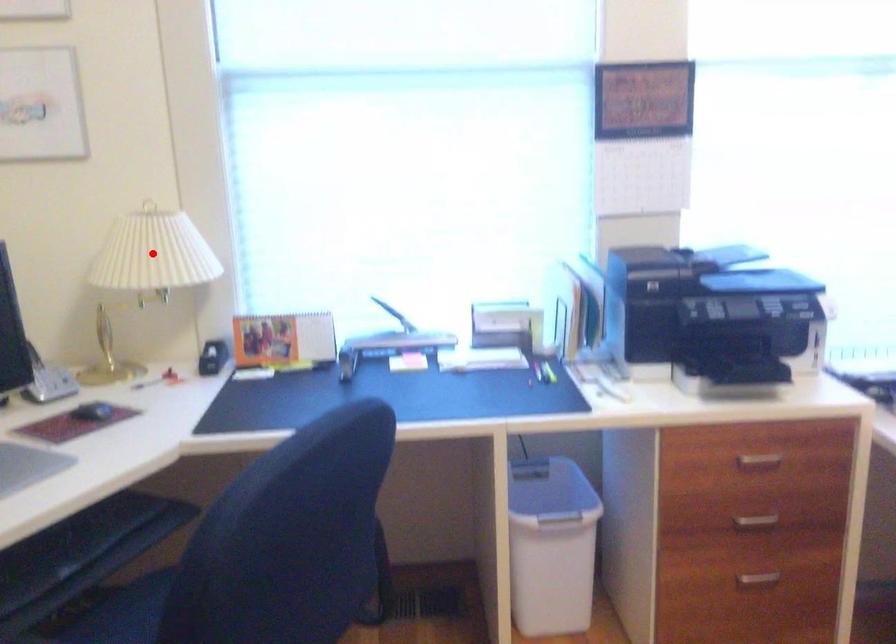
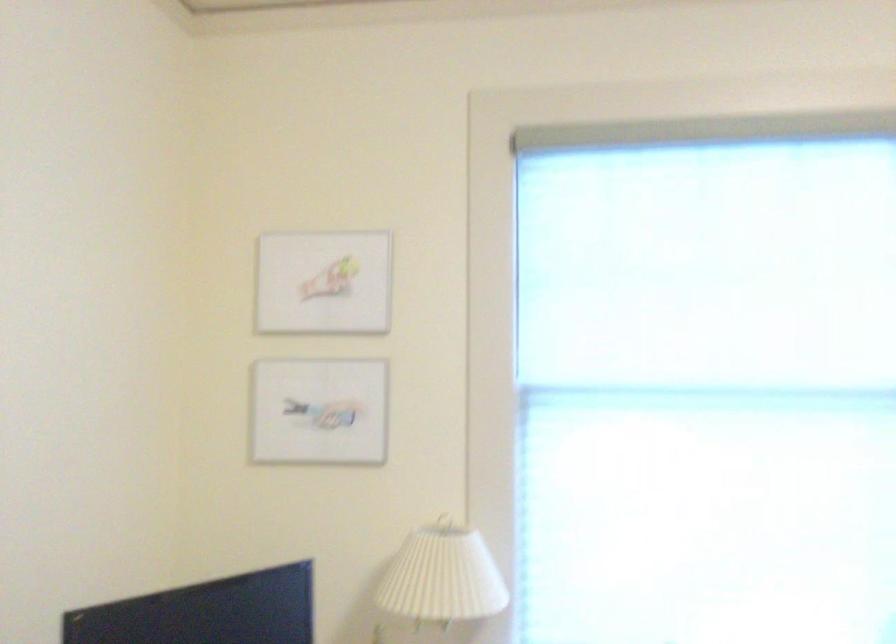
In the second image, find the point that corresponds to the highlighted location in the first image.

(443, 576)